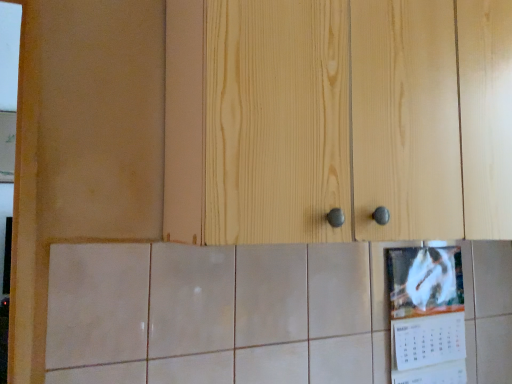
At what (x,y) coordinates should I click in order to perform the action: click on natural wood cabinet at center. Please return your answer as a coordinate pair (x, y). Looking at the image, I should click on (331, 120).

What do you see at coordinates (331, 120) in the screenshot? I see `natural wood cabinet at center` at bounding box center [331, 120].

I want to click on natural wood cabinet at center, so click(331, 120).